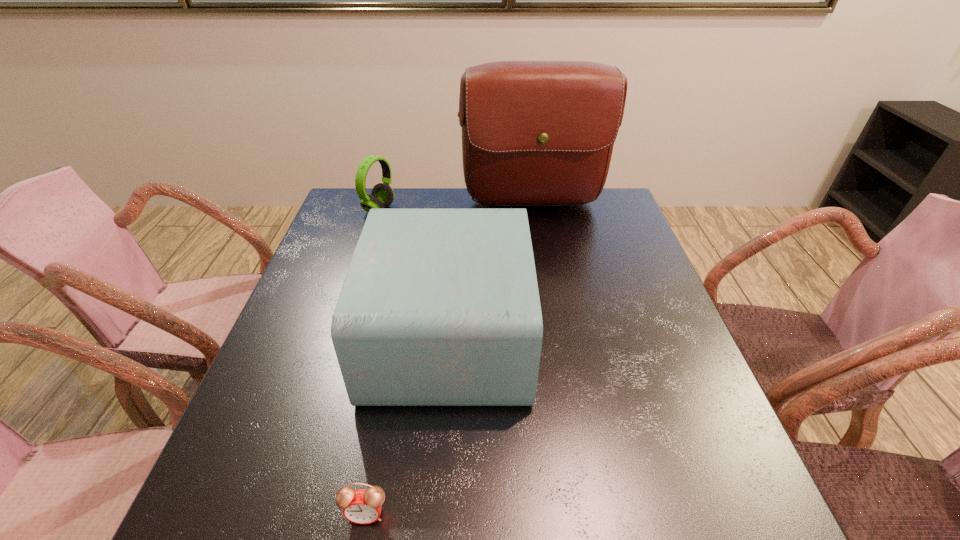
This screenshot has height=540, width=960. I want to click on satchel, so click(x=534, y=133).

Identify the location of radio receiver. The image size is (960, 540). [440, 306].

What are the coordinates of `the second nearest object` in the screenshot? It's located at (440, 306).

The width and height of the screenshot is (960, 540). What are the coordinates of `the third tallest object` in the screenshot? It's located at (382, 195).

You are a GUI agent. You are given a task and a screenshot of the screen. Output one action in this format:
    pyautogui.click(x=<x>, y=<y>)
    Task: Click on the headset
    This screenshot has width=960, height=540.
    Given the screenshot: What is the action you would take?
    pyautogui.click(x=382, y=195)

This screenshot has width=960, height=540. What are the coordinates of `the shortest object` in the screenshot? It's located at (363, 506).

At what (x,y) coordinates should I click in order to perform the action: click on the nearest object. Please return your answer as a coordinate pair (x, y). Looking at the image, I should click on (363, 506).

You are a GUI agent. You are given a task and a screenshot of the screen. Output one action in this format:
    pyautogui.click(x=<x>, y=<y>)
    Task: Click on the vacant space located on the open flap of the satchel
    The image size is (960, 540).
    Given the screenshot: What is the action you would take?
    pyautogui.click(x=550, y=308)

Where is `vacant area situated on the front panel of the radio receiver`? vacant area situated on the front panel of the radio receiver is located at coordinates (596, 335).

Identify the location of blank space located on the front of the leftmost object. The image size is (960, 540). (348, 305).